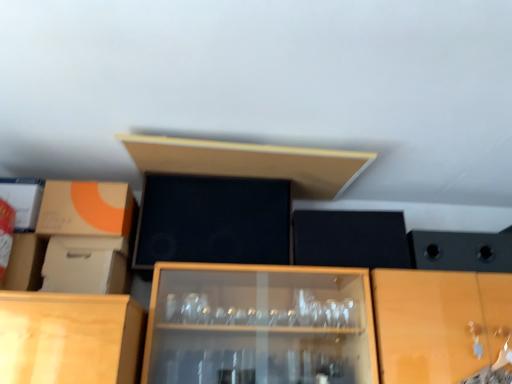
Question: Can you confirm if white cardboard box at left, arranged as the second cardboard box when viewed from the top, is thinner than matte cardboard box at left, which is the first cardboard box from top to bottom?

Choices:
 (A) no
 (B) yes

Answer: (A)

Question: Does white cardboard box at left, which is counted as the 1th cardboard box, starting from the bottom, have a lesser height compared to matte cardboard box at left, the second cardboard box positioned from the bottom?

Choices:
 (A) no
 (B) yes

Answer: (B)

Question: From the image's perspective, is white cardboard box at left, arranged as the second cardboard box when viewed from the top, over matte cardboard box at left, which is the first cardboard box from top to bottom?

Choices:
 (A) no
 (B) yes

Answer: (A)

Question: From a real-world perspective, is white cardboard box at left, which is counted as the 1th cardboard box, starting from the bottom, located beneath matte cardboard box at left, the second cardboard box positioned from the bottom?

Choices:
 (A) no
 (B) yes

Answer: (B)

Question: Is white cardboard box at left, arranged as the second cardboard box when viewed from the top, further to camera compared to matte cardboard box at left, which is the first cardboard box from top to bottom?

Choices:
 (A) yes
 (B) no

Answer: (B)

Question: Is white cardboard box at left, which is counted as the 1th cardboard box, starting from the bottom, aimed at matte cardboard box at left, the second cardboard box positioned from the bottom?

Choices:
 (A) yes
 (B) no

Answer: (B)

Question: Does matte wood shelf at upper center have a lesser height compared to black matte speaker at center?

Choices:
 (A) no
 (B) yes

Answer: (B)

Question: Is matte wood shelf at upper center looking in the opposite direction of black matte speaker at center?

Choices:
 (A) no
 (B) yes

Answer: (A)

Question: Is matte wood shelf at upper center not close to black matte speaker at center?

Choices:
 (A) yes
 (B) no

Answer: (B)

Question: Does matte wood shelf at upper center come behind black matte speaker at center?

Choices:
 (A) no
 (B) yes

Answer: (A)

Question: Is matte wood shelf at upper center directly adjacent to black matte speaker at center?

Choices:
 (A) no
 (B) yes

Answer: (A)

Question: From the image's perspective, is matte wood shelf at upper center beneath black matte speaker at center?

Choices:
 (A) no
 (B) yes

Answer: (A)

Question: Considering the relative sizes of matte cardboard box at left, which is the first cardboard box from top to bottom, and black matte speaker at center in the image provided, is matte cardboard box at left, which is the first cardboard box from top to bottom, smaller than black matte speaker at center?

Choices:
 (A) no
 (B) yes

Answer: (A)